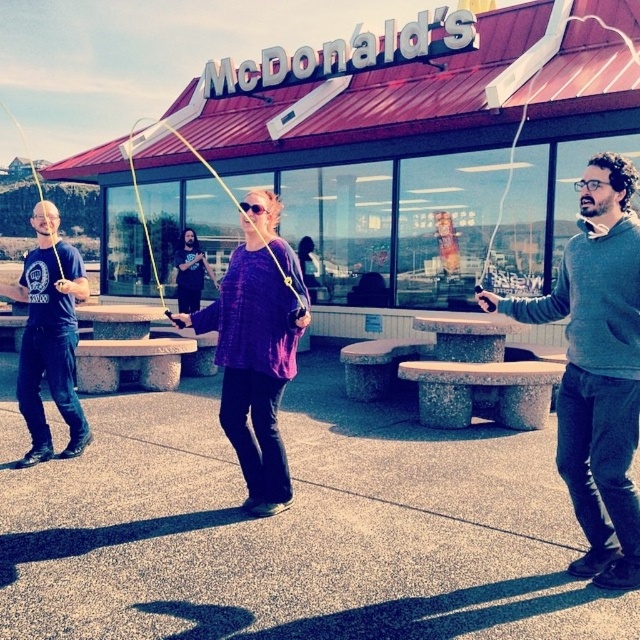
You are standing in front of the McDonalds building and see a point at coordinates (256, 349). What object is located at that point?

The point at coordinates (256, 349) indicates the purple woven sweater at center.